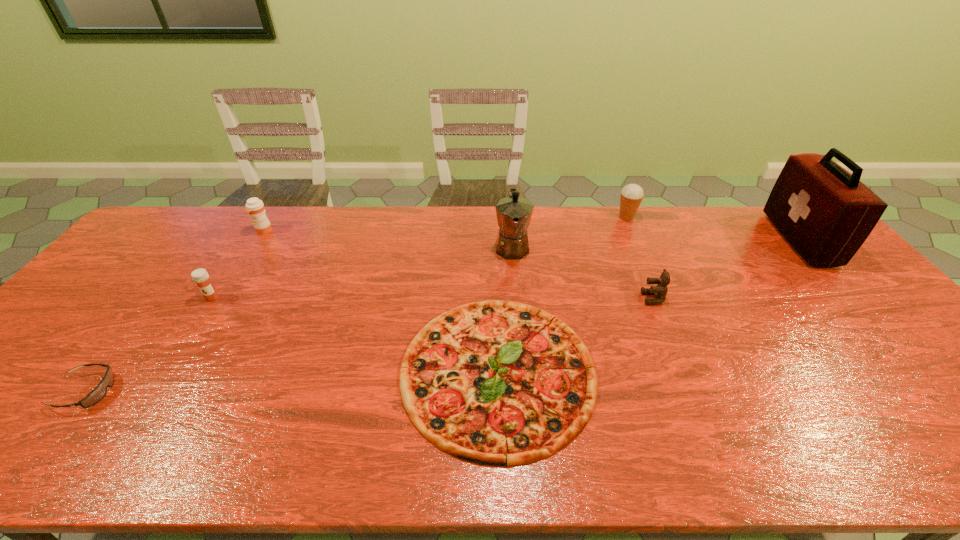
You are a GUI agent. You are given a task and a screenshot of the screen. Output one action in this format:
    pyautogui.click(x=<x>, y=<y>)
    Task: Click on the vacant space located on the lenses of the seventh tallest object
    This screenshot has height=540, width=960.
    Given the screenshot: What is the action you would take?
    pyautogui.click(x=286, y=392)

Find the location of `vacant space located 0.300m on the back of the shortest object`. vacant space located 0.300m on the back of the shortest object is located at coordinates (493, 237).

Locate an element on the screen. The image size is (960, 540). the first aid kit positioned at the far edge is located at coordinates (825, 213).

The image size is (960, 540). Identify the location of coffeepot present at the far edge. (514, 213).

The height and width of the screenshot is (540, 960). What are the coordinates of `icecream situated at the far edge` in the screenshot? It's located at (631, 196).

Where is `medicine that is at the far edge`? Image resolution: width=960 pixels, height=540 pixels. medicine that is at the far edge is located at coordinates (255, 207).

I want to click on object that is at the near edge, so click(495, 382).

Image resolution: width=960 pixels, height=540 pixels. Find the location of `object located in the left edge section of the desktop`. object located in the left edge section of the desktop is located at coordinates (99, 392).

Find the location of a particular element. object positioned at the right edge is located at coordinates (825, 213).

Where is `object that is at the far right corner`? This screenshot has height=540, width=960. object that is at the far right corner is located at coordinates (825, 213).